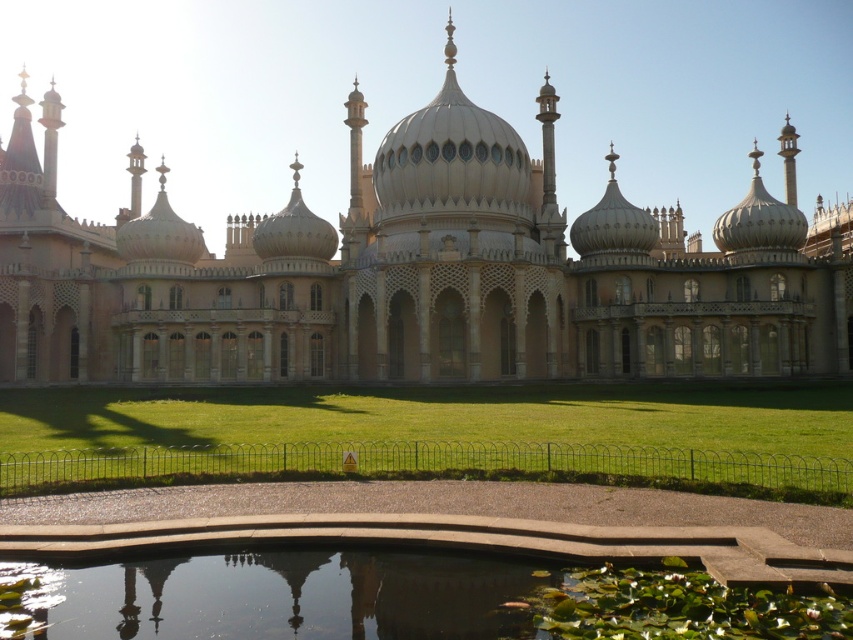
You are standing in front of the grand architectural structure and want to determine which of the two points, point (598, 339) or point (409, 470), is closer to you. Based on the structure, which point is nearer?

Point (598, 339) is closer to you because it is further to the viewer than point (409, 470).

You are an architect designing a new garden layout for the palace. The garden must include both the beige stone palace at center and the transparent glass pond at center. Since the palace is larger, where should the pond be placed relative to the palace to maintain visual balance?

The transparent glass pond at center should be placed closer to the beige stone palace at center to balance their sizes, as the palace is larger and the pond is smaller.

You are standing in front of the beige stone palace at center and want to walk towards the green grass at lower center. In which direction should you move relative to the palace?

You should move to the right of the beige stone palace at center to reach the green grass at lower center since the palace is to the left of the grass.